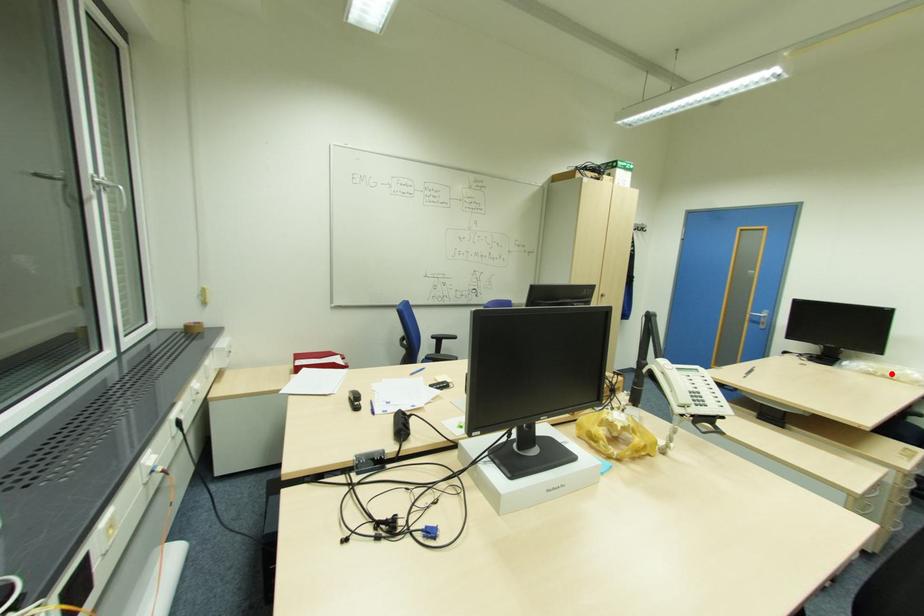
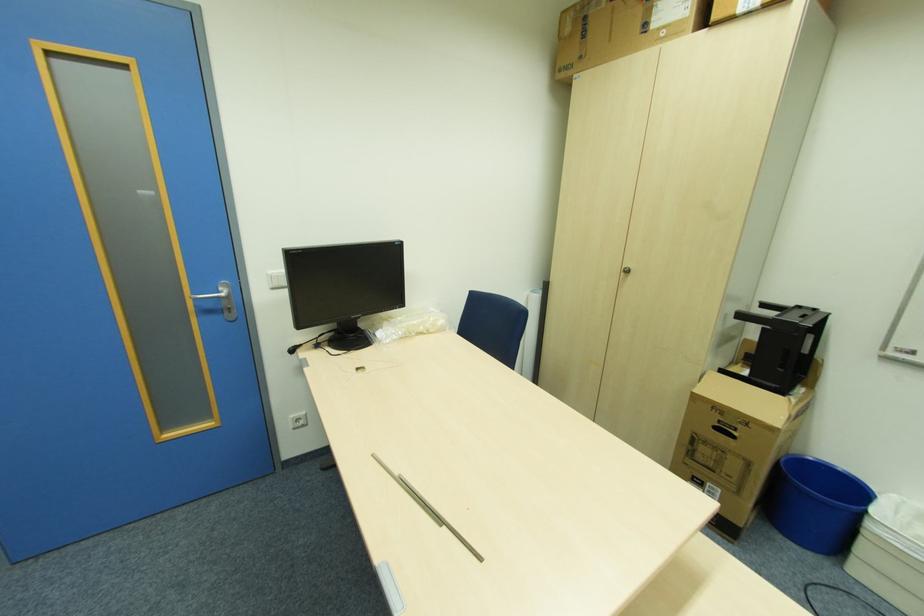
Where in the second image is the point corresponding to the highlighted location from the first image?

(424, 329)